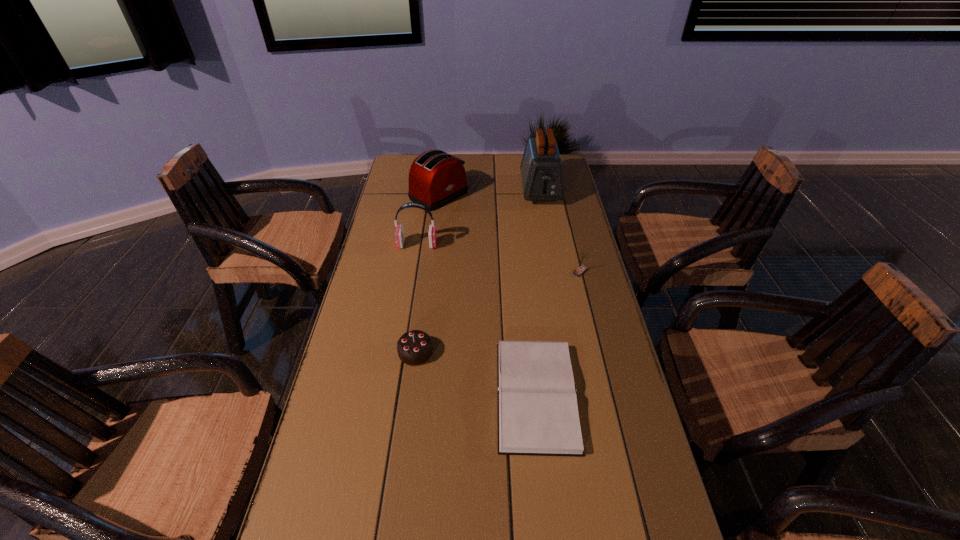
Identify the location of object that is at the far left corner. (436, 178).

This screenshot has height=540, width=960. In order to click on object present at the far right corner in this screenshot , I will do `click(541, 167)`.

Find the location of a particular element. This screenshot has width=960, height=540. free space at the far edge of the desktop is located at coordinates (490, 165).

This screenshot has height=540, width=960. Find the location of `vacant space at the left edge of the desktop`. vacant space at the left edge of the desktop is located at coordinates (412, 240).

You are a GUI agent. You are given a task and a screenshot of the screen. Output one action in this format:
    pyautogui.click(x=<x>, y=<y>)
    Task: Click on the free point at the right edge
    
    Given the screenshot: What is the action you would take?
    pyautogui.click(x=613, y=393)

Where is `free space between the right toaster and the hardback book`? free space between the right toaster and the hardback book is located at coordinates (539, 293).

Identify the location of vacant region between the fourth tallest object and the right toaster. (560, 231).

Identify the location of vacant space that's between the shorter toaster and the hardback book. The height and width of the screenshot is (540, 960). (488, 295).

Where is `free space between the shortest object and the fourth nearest object`? Image resolution: width=960 pixels, height=540 pixels. free space between the shortest object and the fourth nearest object is located at coordinates (477, 320).

I want to click on empty space that is in between the matchbox and the fifth tallest object, so click(x=498, y=312).